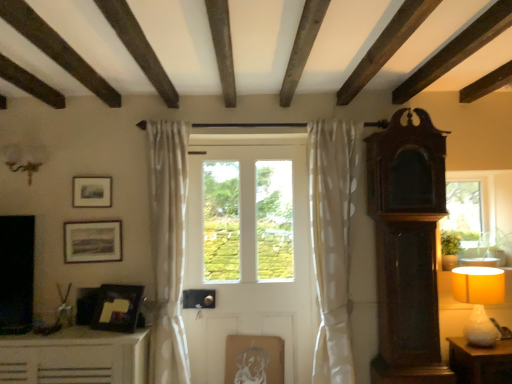
This screenshot has height=384, width=512. I want to click on blank space above matte wooden picture frame at center, marked as the fourth picture frame in a front-to-back arrangement (from a real-world perspective), so click(254, 335).